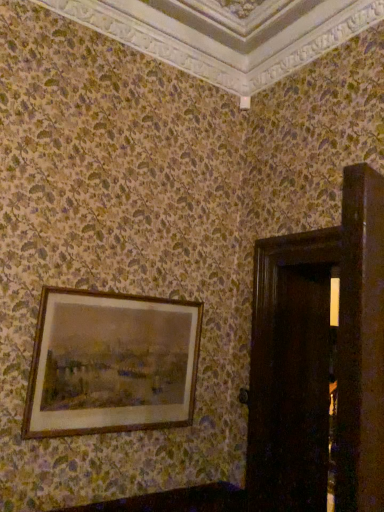
Question: From a real-world perspective, is wooden frame at upper left positioned over dark wood door at right based on gravity?

Choices:
 (A) yes
 (B) no

Answer: (A)

Question: Does wooden frame at upper left have a smaller size compared to dark wood door at right?

Choices:
 (A) no
 (B) yes

Answer: (B)

Question: From the image's perspective, is wooden frame at upper left on dark wood door at right?

Choices:
 (A) yes
 (B) no

Answer: (A)

Question: From the image's perspective, is wooden frame at upper left located beneath dark wood door at right?

Choices:
 (A) no
 (B) yes

Answer: (A)

Question: Could you tell me if wooden frame at upper left is turned towards dark wood door at right?

Choices:
 (A) no
 (B) yes

Answer: (A)

Question: Is wooden frame at upper left at the left side of dark wood door at right?

Choices:
 (A) yes
 (B) no

Answer: (A)

Question: Could you tell me if dark wood door at right is turned towards wooden frame at upper left?

Choices:
 (A) yes
 (B) no

Answer: (B)

Question: From the image's perspective, is dark wood door at right above wooden frame at upper left?

Choices:
 (A) no
 (B) yes

Answer: (A)

Question: Considering the relative positions of dark wood door at right and wooden frame at upper left in the image provided, is dark wood door at right to the left of wooden frame at upper left from the viewer's perspective?

Choices:
 (A) yes
 (B) no

Answer: (B)

Question: Does dark wood door at right come behind wooden frame at upper left?

Choices:
 (A) yes
 (B) no

Answer: (B)

Question: Is the surface of dark wood door at right in direct contact with wooden frame at upper left?

Choices:
 (A) yes
 (B) no

Answer: (B)

Question: Considering the relative sizes of dark wood door at right and wooden frame at upper left in the image provided, is dark wood door at right wider than wooden frame at upper left?

Choices:
 (A) no
 (B) yes

Answer: (B)

Question: From a real-world perspective, is wooden frame at upper left positioned above or below dark wood door at right?

Choices:
 (A) above
 (B) below

Answer: (A)